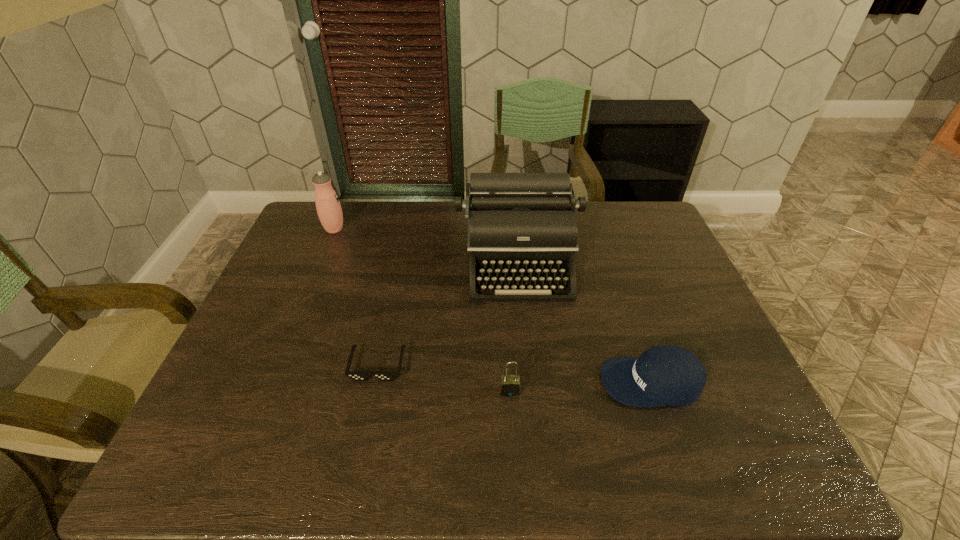
Locate an element on the screen. Image resolution: width=960 pixels, height=540 pixels. free space located 0.390m on the front-facing side of the baseball cap is located at coordinates (436, 382).

The height and width of the screenshot is (540, 960). I want to click on vacant space situated 0.310m on the front-facing side of the baseball cap, so click(x=469, y=382).

Locate an element on the screen. The width and height of the screenshot is (960, 540). free space located on the front-facing side of the second object from left to right is located at coordinates (358, 460).

The image size is (960, 540). Identify the location of thermos bottle at the far edge. (329, 210).

Identify the location of typewriter at the far edge. tap(521, 227).

The height and width of the screenshot is (540, 960). Find the location of `object that is positioned at the left edge`. object that is positioned at the left edge is located at coordinates (329, 210).

Locate an element on the screen. This screenshot has width=960, height=540. object that is at the right edge is located at coordinates (663, 375).

You are a GUI agent. You are given a task and a screenshot of the screen. Output one action in this format:
    pyautogui.click(x=<x>, y=<y>)
    Task: Click on the object located at the far left corner
    The width and height of the screenshot is (960, 540).
    Given the screenshot: What is the action you would take?
    pyautogui.click(x=329, y=210)

Locate an element on the screen. free spot at the far edge of the desktop is located at coordinates (578, 227).

Where is `free space at the near edge`? The width and height of the screenshot is (960, 540). free space at the near edge is located at coordinates (433, 439).